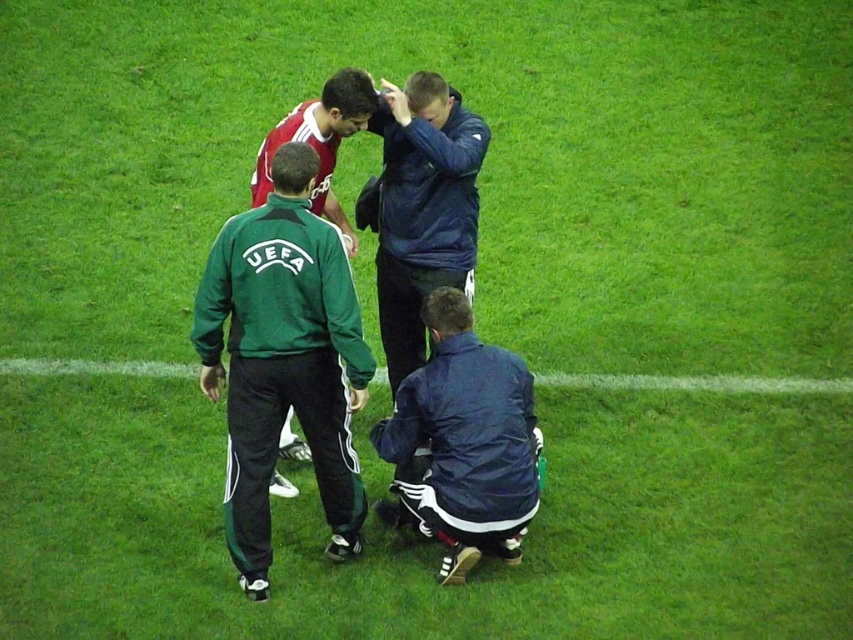
You are a photographer positioned at the back of the field. You need to capture a clear photo of both the green fabric uefa jacket at left and the dark blue jacket at center. Considering their heights, which jacket will appear larger in the photo?

The green fabric uefa jacket at left is much taller than the dark blue jacket at center, so it will appear larger in the photo.

You are a spectator at a soccer match and see the green fabric uefa jacket at left and the red jersey at upper center. Which one is closer to you?

The green fabric uefa jacket at left is closer to you because it is in front of the red jersey at upper center.